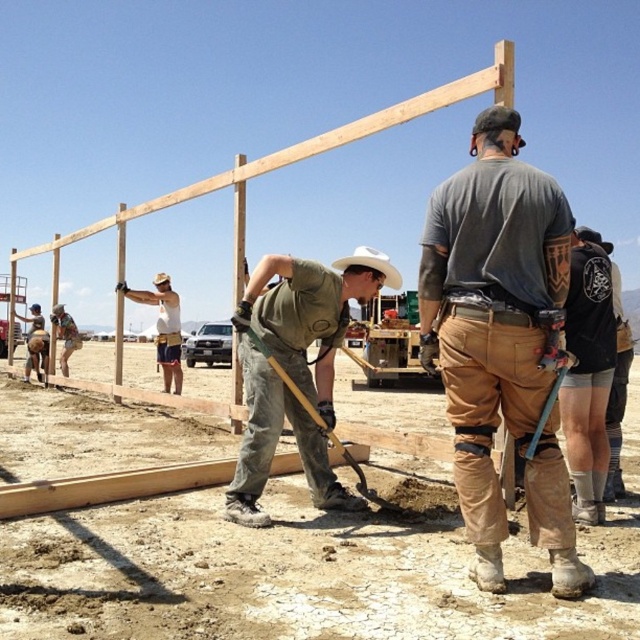
You are standing at the point marked as point (492,314) in the construction site image. What object is located exactly at that coordinate?

The brown or khaki pants are located exactly at point (492,314).